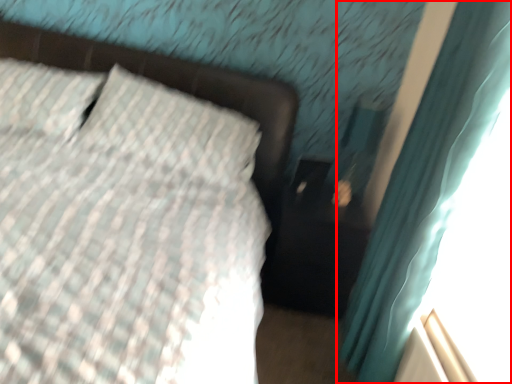
Question: From the image's perspective, where is curtain (annotated by the red box) located in relation to bed frame in the image?

Choices:
 (A) below
 (B) above

Answer: (A)